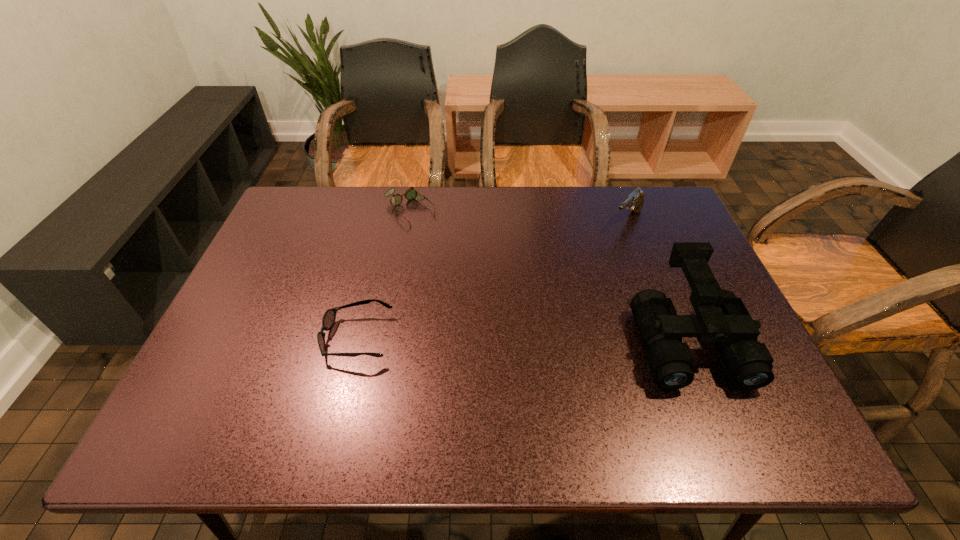
Locate an element on the screen. This screenshot has width=960, height=540. blank space at the far edge of the desktop is located at coordinates (381, 217).

The image size is (960, 540). Identify the location of free region at the near edge of the desktop. (302, 383).

In the image, there is a desktop. Identify the location of vacant space at the left edge. This screenshot has width=960, height=540. (306, 239).

Find the location of a particular element. vacant space at the right edge of the desktop is located at coordinates (706, 356).

The image size is (960, 540). In the image, there is a desktop. In order to click on vacant area at the near right corner in this screenshot , I will do `click(729, 381)`.

At what (x,y) coordinates should I click in order to perform the action: click on vacant point located between the pistol and the sunglasses. Please return your answer as a coordinate pair (x, y). Looking at the image, I should click on (492, 279).

At what (x,y) coordinates should I click in order to perform the action: click on blank region between the pistol and the sunglasses. Please return your answer as a coordinate pair (x, y). The image size is (960, 540). Looking at the image, I should click on (492, 279).

You are a GUI agent. You are given a task and a screenshot of the screen. Output one action in this format:
    pyautogui.click(x=<x>, y=<y>)
    Task: Click on the blank region between the tallest object and the spectacles
    Image resolution: width=960 pixels, height=540 pixels.
    Given the screenshot: What is the action you would take?
    pyautogui.click(x=548, y=275)

At what (x,y) coordinates should I click in order to perform the action: click on free area in between the second tallest object and the spectacles. Please return your answer as a coordinate pair (x, y). Looking at the image, I should click on (518, 216).

Find the location of a particular element. vacant area that lies between the spectacles and the sunglasses is located at coordinates (383, 274).